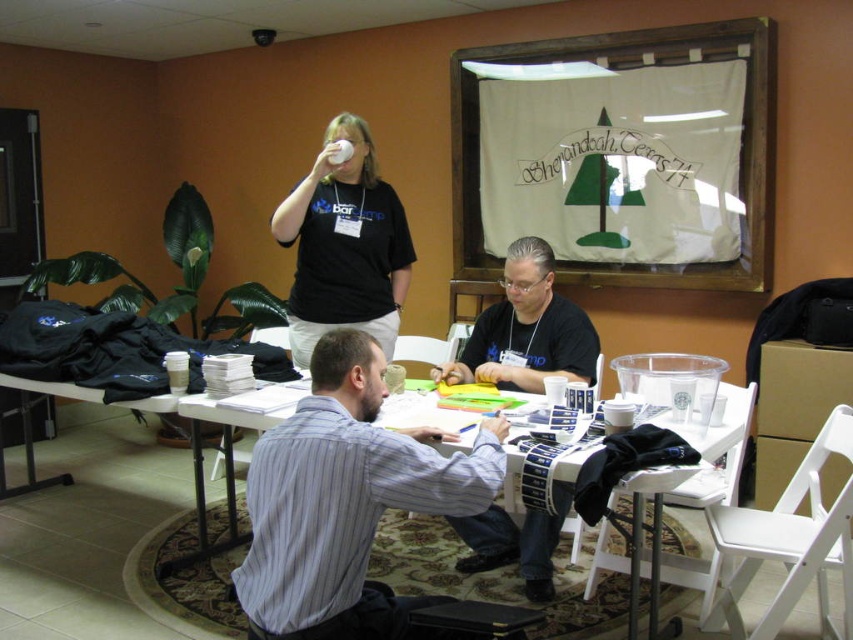
Question: Which point is closer to the camera?

Choices:
 (A) matte black shirt at upper center
 (B) black matte shirt at center
 (C) striped cotton shirt at center
 (D) white plastic table at center

Answer: (C)

Question: Which object is the closest to the black matte shirt at center?

Choices:
 (A) white plastic table at center
 (B) matte black shirt at upper center
 (C) striped cotton shirt at center

Answer: (A)

Question: Can you confirm if striped cotton shirt at center is wider than white plastic table at center?

Choices:
 (A) yes
 (B) no

Answer: (B)

Question: Which point is farther to the camera?

Choices:
 (A) (296, 456)
 (B) (521, 371)
 (C) (587, 564)
 (D) (392, 312)

Answer: (D)

Question: Is striped cotton shirt at center wider than white plastic table at center?

Choices:
 (A) no
 (B) yes

Answer: (A)

Question: Is striped cotton shirt at center to the right of black matte shirt at center from the viewer's perspective?

Choices:
 (A) yes
 (B) no

Answer: (B)